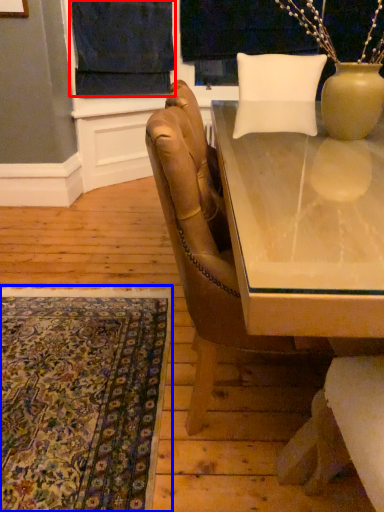
Question: Which of the following is the farthest to the observer, curtain (highlighted by a red box) or mat (highlighted by a blue box)?

Choices:
 (A) curtain
 (B) mat

Answer: (A)